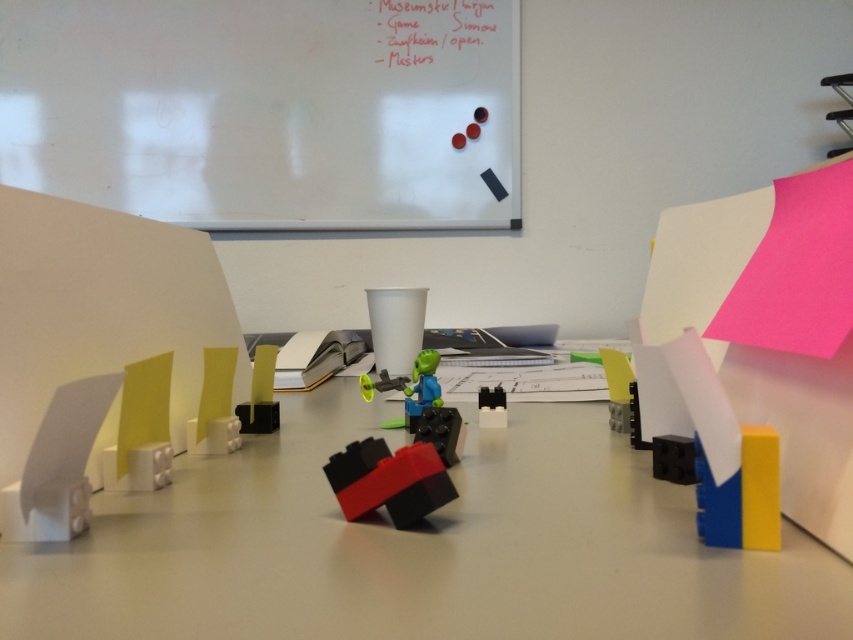
From the picture: Is shiny plastic alien at center to the left of black plastic blocks at center from the viewer's perspective?

Correct, you'll find shiny plastic alien at center to the left of black plastic blocks at center.

Measure the distance between shiny plastic alien at center and camera.

shiny plastic alien at center is 30.74 inches away from camera.

At what (x,y) coordinates should I click in order to perform the action: click on shiny plastic alien at center. Please return your answer as a coordinate pair (x, y). Looking at the image, I should click on (419, 388).

How much distance is there between brick-like plastic blocks at center and black plastic blocks at center?

They are 13.70 inches apart.

Is brick-like plastic blocks at center below black plastic blocks at center?

No.

Does point (334, 468) come farther from viewer compared to point (502, 408)?

No, it is in front of (502, 408).

This screenshot has height=640, width=853. Find the location of `brick-like plastic blocks at center`. brick-like plastic blocks at center is located at coordinates (389, 481).

Based on the photo, can you confirm if brick-like plastic blocks at center is taller than black plastic toy at center?

No, brick-like plastic blocks at center is not taller than black plastic toy at center.

Does brick-like plastic blocks at center have a lesser height compared to black plastic toy at center?

Indeed, brick-like plastic blocks at center has a lesser height compared to black plastic toy at center.

What are the coordinates of `brick-like plastic blocks at center` in the screenshot? It's located at (389, 481).